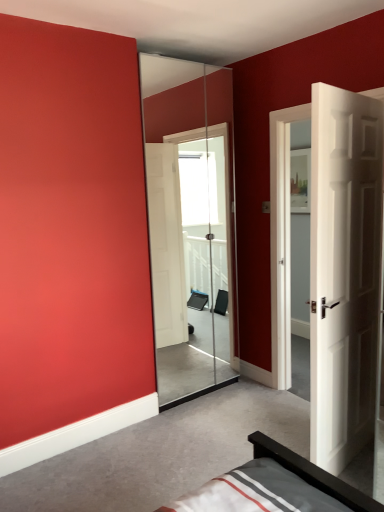
Question: Looking at the image, does transparent glass screen door at center seem bigger or smaller compared to white wooden door at right?

Choices:
 (A) small
 (B) big

Answer: (A)

Question: Is transparent glass screen door at center wider or thinner than white wooden door at right?

Choices:
 (A) wide
 (B) thin

Answer: (B)

Question: In terms of height, does transparent glass screen door at center look taller or shorter compared to white wooden door at right?

Choices:
 (A) short
 (B) tall

Answer: (B)

Question: In terms of width, does white wooden door at right look wider or thinner when compared to transparent glass screen door at center?

Choices:
 (A) thin
 (B) wide

Answer: (B)

Question: Is white wooden door at right in front of or behind transparent glass screen door at center in the image?

Choices:
 (A) behind
 (B) front

Answer: (B)

Question: Is white wooden door at right bigger or smaller than transparent glass screen door at center?

Choices:
 (A) big
 (B) small

Answer: (A)

Question: Considering the positions of point (340, 379) and point (228, 204), is point (340, 379) closer or farther from the camera than point (228, 204)?

Choices:
 (A) closer
 (B) farther

Answer: (A)